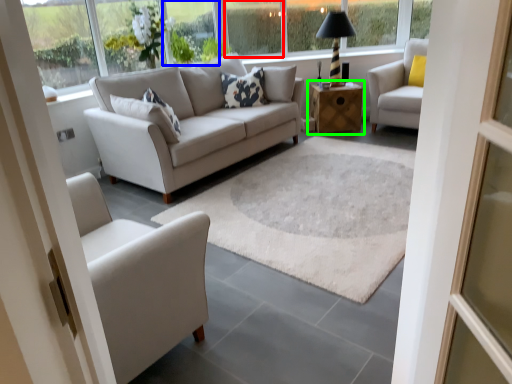
Question: Which object is the farthest from window (highlighted by a red box)? Choose among these: window (highlighted by a blue box) or table (highlighted by a green box).

Choices:
 (A) window
 (B) table

Answer: (B)